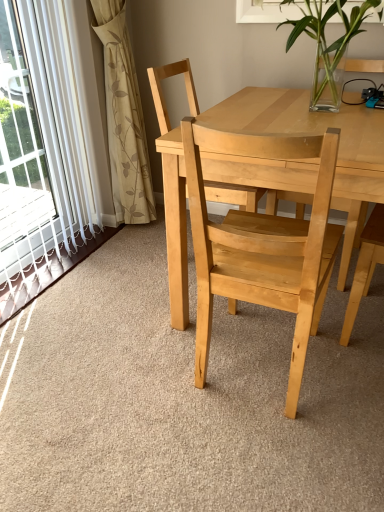
You are a GUI agent. You are given a task and a screenshot of the screen. Output one action in this format:
    pyautogui.click(x=<x>, y=<y>)
    Task: Click on the vacant space underneath natural wood chair at center, the 2th chair when ordered from back to front (from a real-world perspective)
    
    Given the screenshot: What is the action you would take?
    pyautogui.click(x=245, y=374)